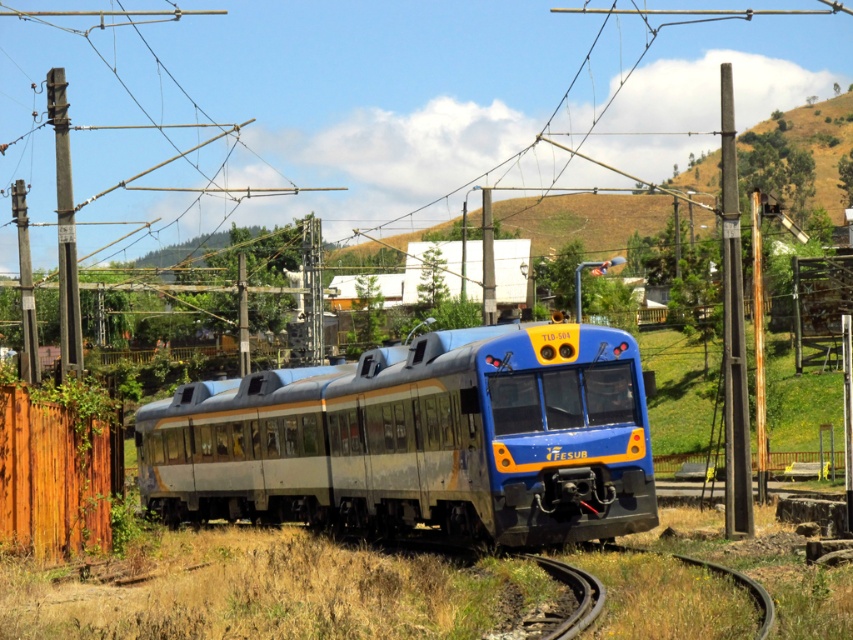
Which of these two, blue metallic train at center or brown wooden fence at lower left, stands taller?

Standing taller between the two is blue metallic train at center.

What do you see at coordinates (418, 440) in the screenshot? This screenshot has width=853, height=640. I see `blue metallic train at center` at bounding box center [418, 440].

Where is `blue metallic train at center`? The width and height of the screenshot is (853, 640). blue metallic train at center is located at coordinates (418, 440).

Is blue metallic train at center behind metallic gray pole at left?

No, it is in front of metallic gray pole at left.

Can you confirm if blue metallic train at center is positioned below metallic gray pole at left?

Yes, blue metallic train at center is below metallic gray pole at left.

What are the coordinates of `blue metallic train at center` in the screenshot? It's located at (418, 440).

Does point (323, 486) come farther from viewer compared to point (728, 336)?

Yes, it is behind point (728, 336).

Can you confirm if blue metallic train at center is thinner than smooth gray pole at right?

Incorrect, blue metallic train at center's width is not less than smooth gray pole at right's.

Who is more distant from viewer, [517,419] or [724,67]?

The point [724,67] is more distant.

You are a GUI agent. You are given a task and a screenshot of the screen. Output one action in this format:
    pyautogui.click(x=<x>, y=<y>)
    Task: Click on the blue metallic train at center
    
    Given the screenshot: What is the action you would take?
    pyautogui.click(x=418, y=440)